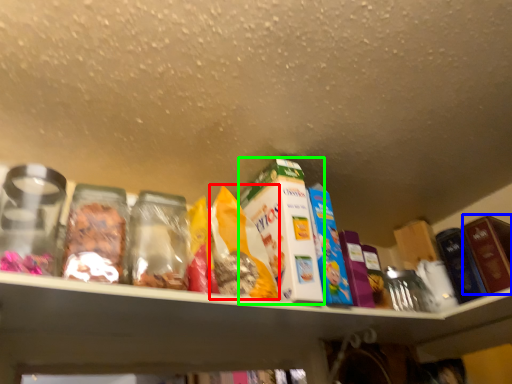
Question: Which is nearer to the cereal (highlighted by a red box)? product (highlighted by a blue box) or product (highlighted by a green box).

Choices:
 (A) product
 (B) product

Answer: (B)